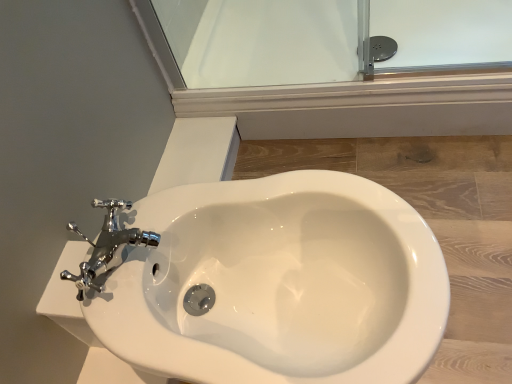
Question: From the image's perspective, is white glossy bidet at center located above or below transparent glass door at upper center?

Choices:
 (A) above
 (B) below

Answer: (B)

Question: Considering the positions of white glossy bidet at center and transparent glass door at upper center in the image, is white glossy bidet at center taller or shorter than transparent glass door at upper center?

Choices:
 (A) tall
 (B) short

Answer: (A)

Question: Which is nearer to the transparent glass door at upper center?

Choices:
 (A) white glossy bidet at center
 (B) chrome metallic faucet at upper left

Answer: (A)

Question: Estimate the real-world distances between objects in this image. Which object is closer to the chrome metallic faucet at upper left?

Choices:
 (A) transparent glass door at upper center
 (B) white glossy bidet at center

Answer: (B)